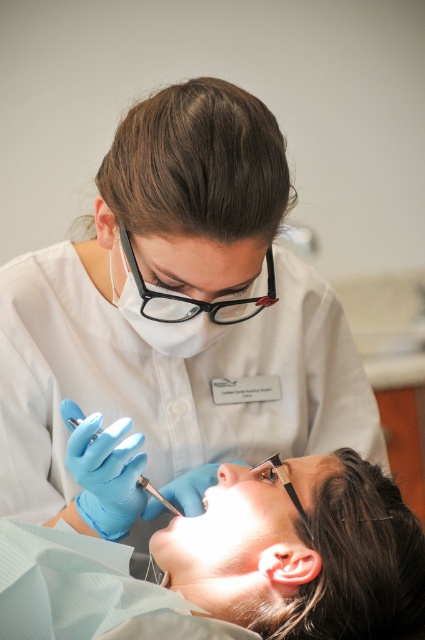
Identify the location of matte blue gloves at lower left. (234, 564).

Is point (74, 586) positioned in front of point (150, 486)?

Yes, it is.

The image size is (425, 640). I want to click on matte blue gloves at lower left, so click(x=234, y=564).